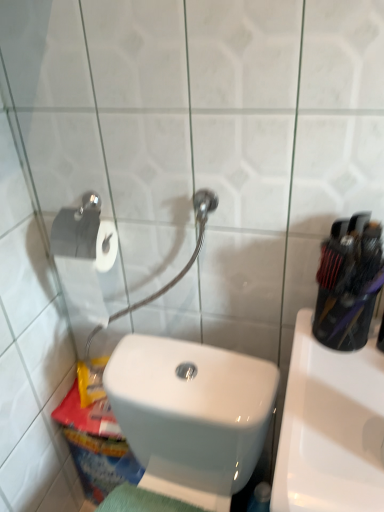
Where is `vacant region above white glossy sink at right (from a real-world perspective)`? The height and width of the screenshot is (512, 384). vacant region above white glossy sink at right (from a real-world perspective) is located at coordinates (344, 394).